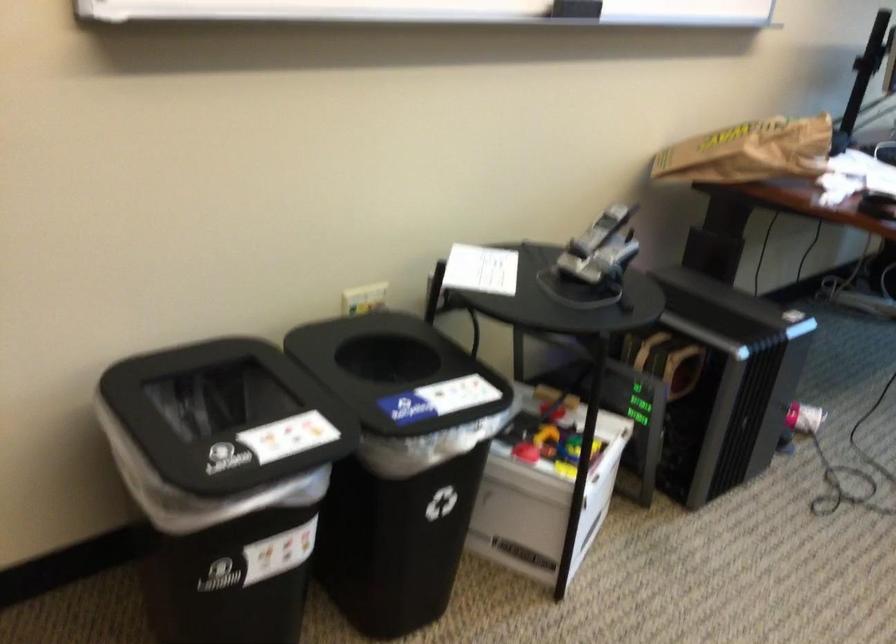
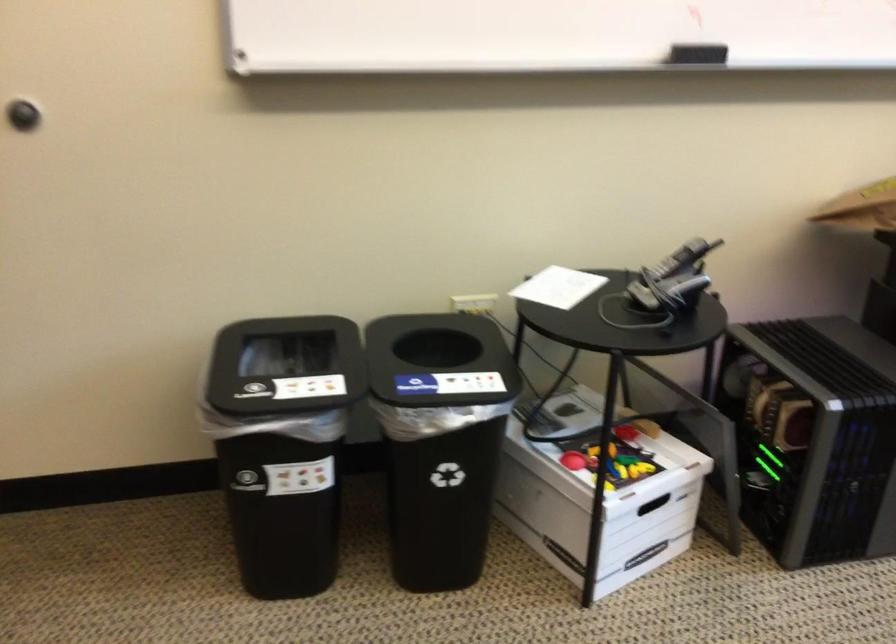
Where in the second image is the point corresponding to point 720,382 from the first image?

(813, 436)